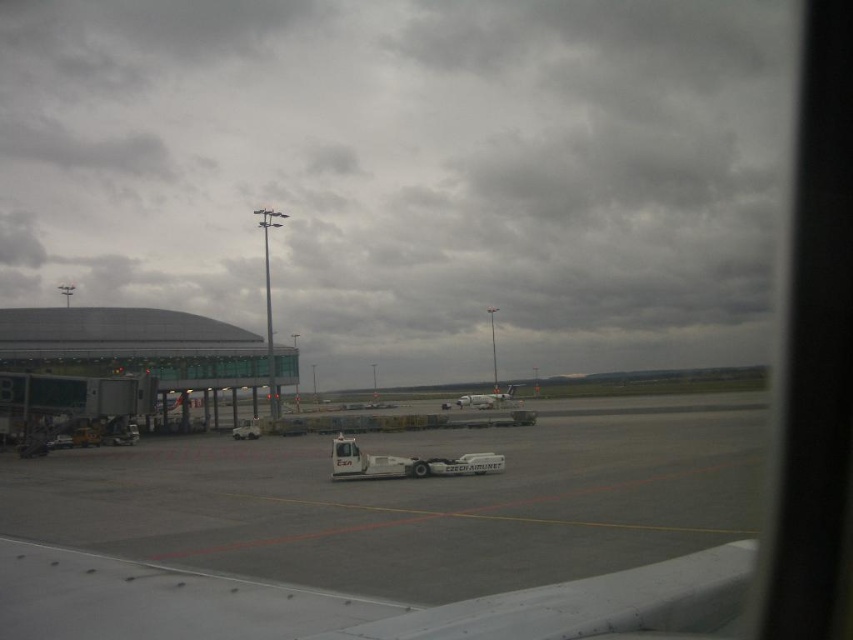
You are a pilot standing at the white rubber tarmac at center and need to reach the transparent glass terminal at left. The airport requires that all personnel walk along the designated red and yellow lines on the tarmac. If the shortest path along these lines is 25 meters, can you safely walk to the terminal within the 25 meter limit?

The distance between the white rubber tarmac at center and the transparent glass terminal at left is 20.60 meters. Since the shortest path along the designated lines is 25 meters, which is longer than the straight line distance, you can safely walk to the terminal within the 25 meter limit as it accommodates the required path.

You are a pilot preparing to board the white matte airplane at center. From your current position on the white rubber tarmac at center, can you directly walk to the airplane without stepping off the tarmac?

The white rubber tarmac at center is located above the white matte airplane at center, so you can directly walk to the airplane without stepping off the tarmac.

You are a pilot preparing to taxi your plane from the runway to the terminal. You see the white rubber tarmac at center and the transparent glass terminal at left. Which direction should you steer your plane to reach the terminal?

You should steer your plane to the left towards the transparent glass terminal at left because the white rubber tarmac at center is to the right of the transparent glass terminal at left, meaning the terminal is on the left side relative to the tarmac.